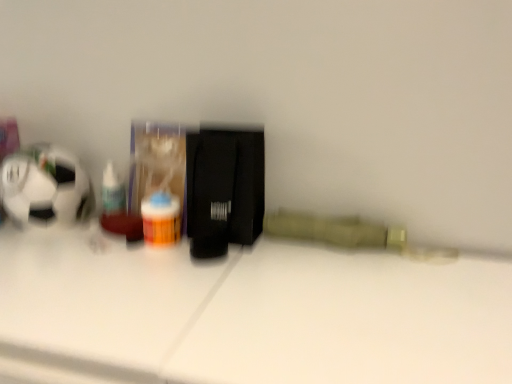
This screenshot has height=384, width=512. I want to click on free spot in front of translucent plastic pill bottle at center, so click(x=139, y=290).